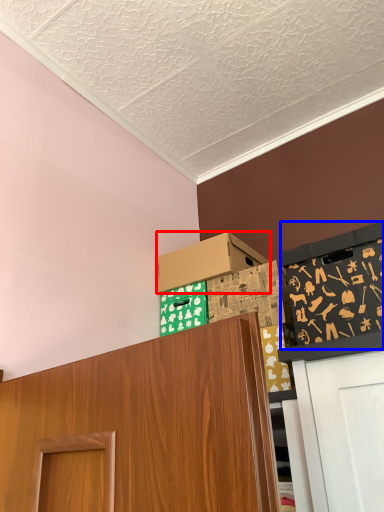
Question: Which point is further to the camera, box (highlighted by a red box) or bulletin board (highlighted by a blue box)?

Choices:
 (A) box
 (B) bulletin board

Answer: (A)